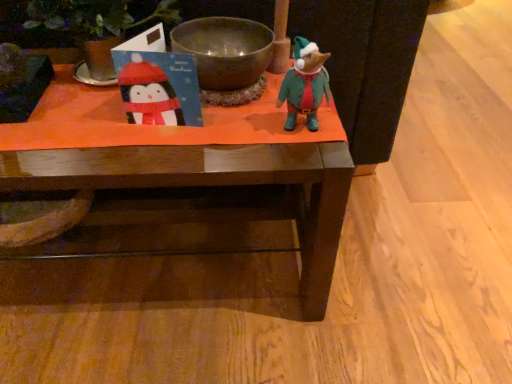
Where is `vacant area that lies to the right of wooden table at center`? vacant area that lies to the right of wooden table at center is located at coordinates (404, 258).